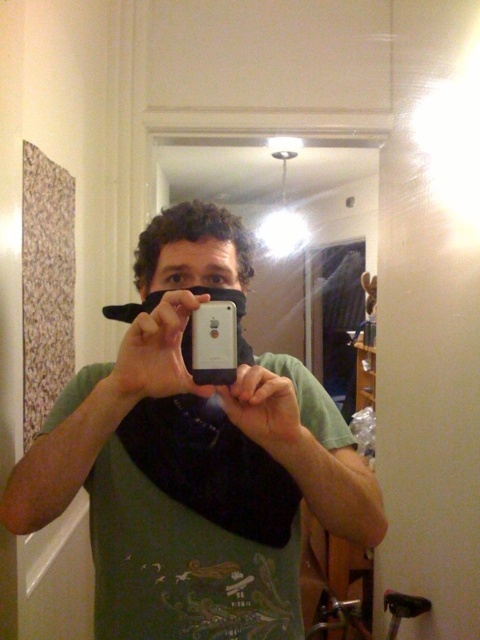
Question: Observing the image, what is the correct spatial positioning of green matte shirt at center in reference to white matte smartphone at center?

Choices:
 (A) above
 (B) below

Answer: (B)

Question: Which object is farther from the camera taking this photo?

Choices:
 (A) white matte smartphone at center
 (B) green matte shirt at center

Answer: (A)

Question: Which of the following is the closest to the observer?

Choices:
 (A) (236, 346)
 (B) (275, 384)

Answer: (B)

Question: Is green matte shirt at center positioned behind white matte smartphone at center?

Choices:
 (A) yes
 (B) no

Answer: (B)

Question: Does green matte shirt at center have a greater width compared to white matte smartphone at center?

Choices:
 (A) no
 (B) yes

Answer: (B)